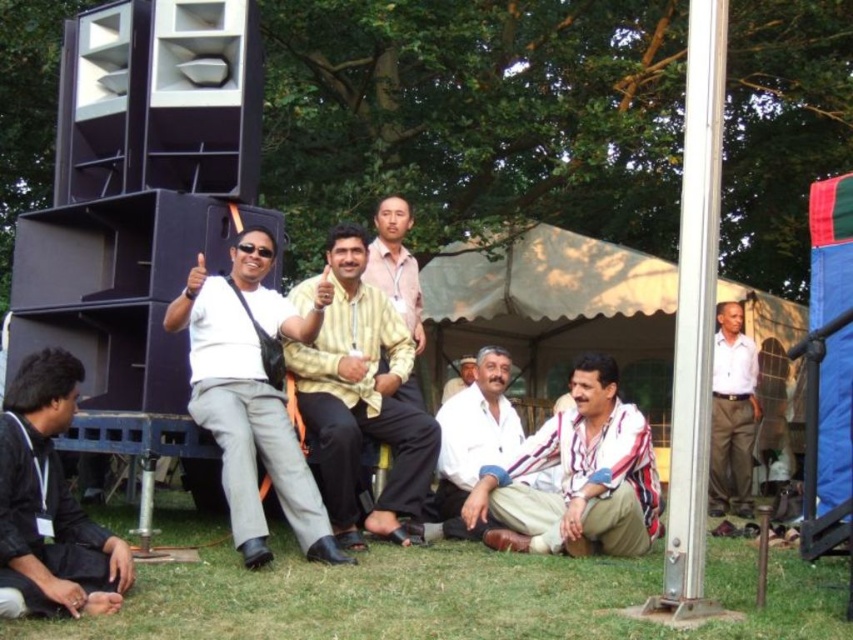
Between yellow cotton shirt at center and white cotton shirt at center, which one has less height?

white cotton shirt at center

Is point (361, 365) farther from viewer compared to point (461, 508)?

No.

Which is behind, point (308, 369) or point (503, 349)?

Point (503, 349)

At what (x,y) coordinates should I click in order to perform the action: click on yellow cotton shirt at center. Please return your answer as a coordinate pair (x, y). Looking at the image, I should click on (363, 401).

Does point (602, 564) lie behind point (715, 403)?

That is False.

Is green grass at lower center to the right of white cotton shirt at right from the viewer's perspective?

In fact, green grass at lower center is to the left of white cotton shirt at right.

Find the location of a particular element. green grass at lower center is located at coordinates (454, 596).

Who is higher up, beige canvas canopy at upper center or white cotton shirt at center?

beige canvas canopy at upper center is above.

Does point (483, 298) lie in front of point (477, 362)?

No, (483, 298) is further to viewer.

Image resolution: width=853 pixels, height=640 pixels. Identify the location of beige canvas canopy at upper center. tap(547, 282).